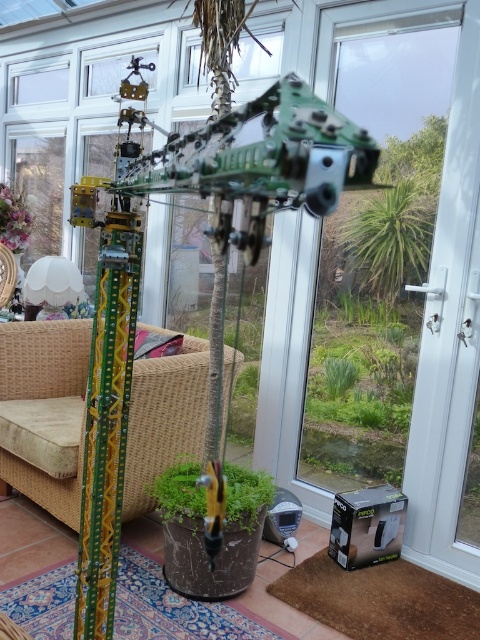
You are standing at the center of the conservatory and want to sit down. There is a wicker armchair at lower left. Based on its coordinates, can you estimate how far it is from your current position?

The wicker armchair at lower left is located at coordinates point (44, 412), which means it is positioned to the lower left side of the conservatory. Since you are at the center, the distance would require moving towards the lower left direction to reach it.

You are sitting in the wicker armchair at lower left and want to turn on the light. Can you reach the white fabric lampshade at lower left to turn it on?

The wicker armchair at lower left is positioned under the white fabric lampshade at lower left, so yes, you can reach the white fabric lampshade at lower left to turn it on.

You are sitting in the wicker armchair at lower left and want to turn on the white fabric lampshade at lower left. Can you reach it without getting up?

The wicker armchair at lower left is in front of the white fabric lampshade at lower left, so you are closer to it. You can probably reach it without getting up.